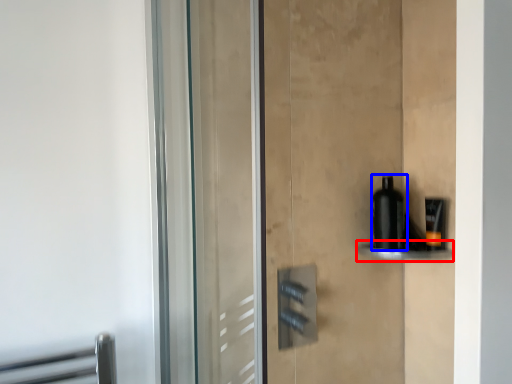
Question: Which point is closer to the camera, shelf (highlighted by a red box) or bottle (highlighted by a blue box)?

Choices:
 (A) shelf
 (B) bottle

Answer: (A)